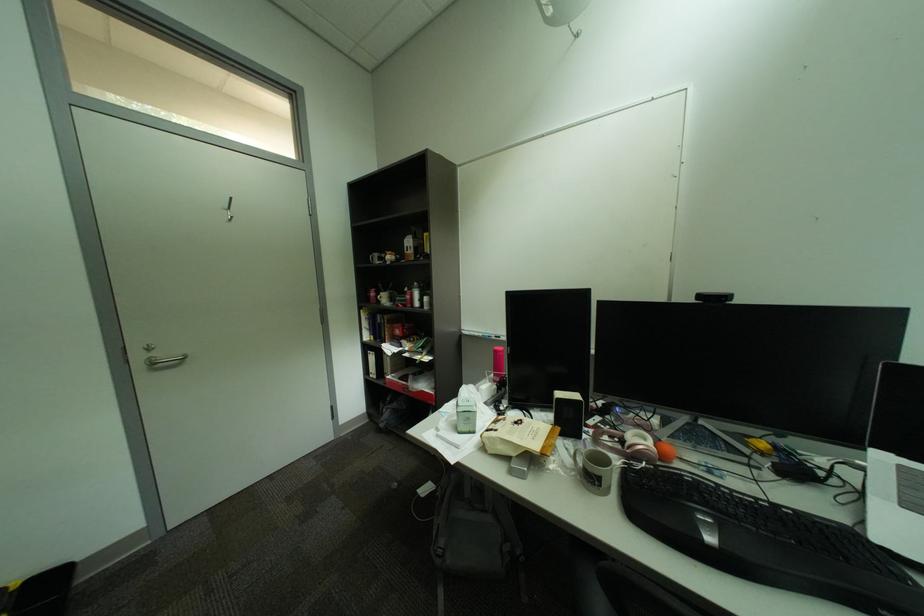
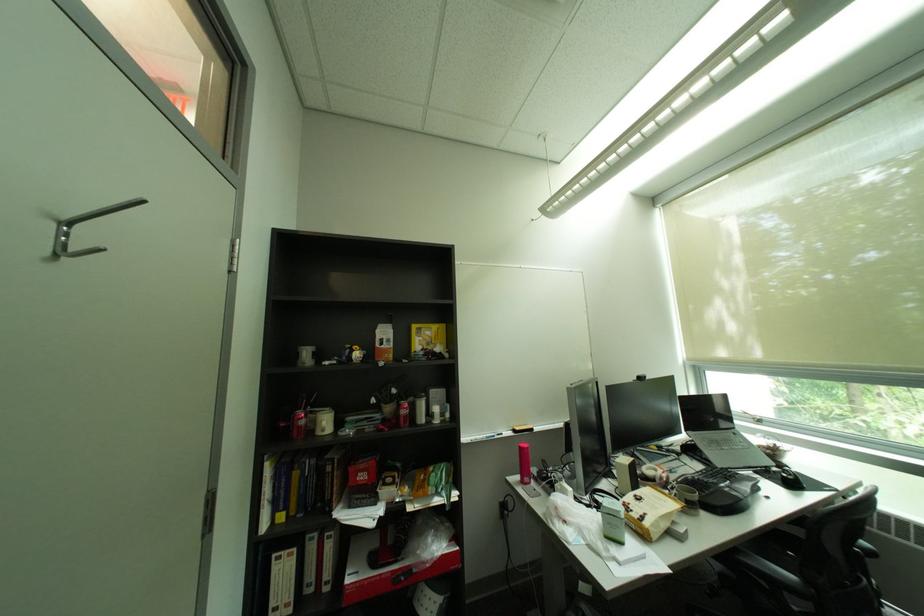
The point at [380,296] is marked in the first image. Where is the corresponding point in the second image?

(293, 426)